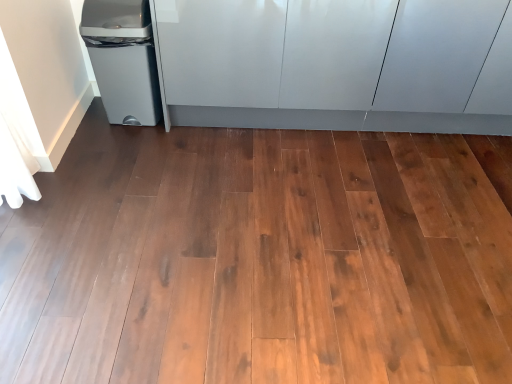
Identify the location of free space in front of matte gray plastic trash can at left. The height and width of the screenshot is (384, 512). (119, 145).